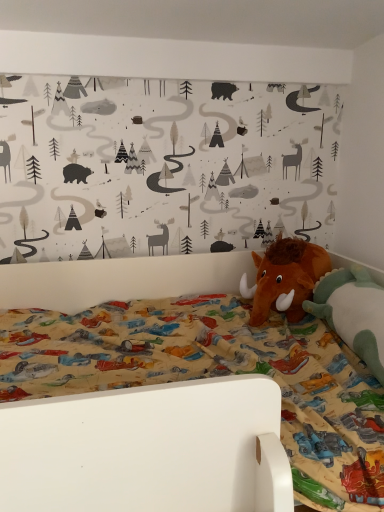
Question: Is brown plush mammoth at right, placed as the 1th toy when sorted from back to front, to the right of brown plush mammoth at right, the 1th toy from the front, from the viewer's perspective?

Choices:
 (A) no
 (B) yes

Answer: (A)

Question: From the image's perspective, is brown plush mammoth at right, the 2th toy viewed from the front, beneath brown plush mammoth at right, the second toy when ordered from back to front?

Choices:
 (A) no
 (B) yes

Answer: (A)

Question: Does brown plush mammoth at right, placed as the 1th toy when sorted from back to front, lie behind brown plush mammoth at right, the 1th toy from the front?

Choices:
 (A) yes
 (B) no

Answer: (A)

Question: Is brown plush mammoth at right, the 2th toy viewed from the front, far away from brown plush mammoth at right, the second toy when ordered from back to front?

Choices:
 (A) yes
 (B) no

Answer: (B)

Question: Considering the relative sizes of brown plush mammoth at right, placed as the 1th toy when sorted from back to front, and brown plush mammoth at right, the 1th toy from the front, in the image provided, is brown plush mammoth at right, placed as the 1th toy when sorted from back to front, shorter than brown plush mammoth at right, the 1th toy from the front,?

Choices:
 (A) yes
 (B) no

Answer: (B)

Question: Is brown plush mammoth at right, placed as the 1th toy when sorted from back to front, thinner than brown plush mammoth at right, the 1th toy from the front?

Choices:
 (A) no
 (B) yes

Answer: (A)

Question: Could you tell me if brown plush mammoth at right, the 1th toy from the front, is facing brown plush mammoth at right, placed as the 1th toy when sorted from back to front?

Choices:
 (A) yes
 (B) no

Answer: (B)

Question: From the image's perspective, would you say brown plush mammoth at right, the second toy when ordered from back to front, is shown under brown plush mammoth at right, the 2th toy viewed from the front?

Choices:
 (A) no
 (B) yes

Answer: (B)

Question: Can you see brown plush mammoth at right, the second toy when ordered from back to front, touching brown plush mammoth at right, the 2th toy viewed from the front?

Choices:
 (A) yes
 (B) no

Answer: (B)

Question: Can you confirm if brown plush mammoth at right, the 1th toy from the front, is smaller than brown plush mammoth at right, placed as the 1th toy when sorted from back to front?

Choices:
 (A) yes
 (B) no

Answer: (B)

Question: From a real-world perspective, does brown plush mammoth at right, the second toy when ordered from back to front, sit lower than brown plush mammoth at right, placed as the 1th toy when sorted from back to front?

Choices:
 (A) no
 (B) yes

Answer: (B)

Question: From a real-world perspective, is brown plush mammoth at right, the 1th toy from the front, over brown plush mammoth at right, placed as the 1th toy when sorted from back to front?

Choices:
 (A) no
 (B) yes

Answer: (A)

Question: Is point (244, 288) closer or farther from the camera than point (375, 339)?

Choices:
 (A) closer
 (B) farther

Answer: (B)